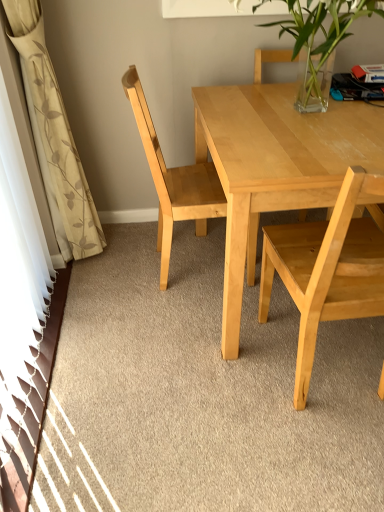
Image resolution: width=384 pixels, height=512 pixels. I want to click on free area in between white floral fabric curtain at left and light wood chair at right, which appears as the second chair when viewed from the left, so click(x=182, y=317).